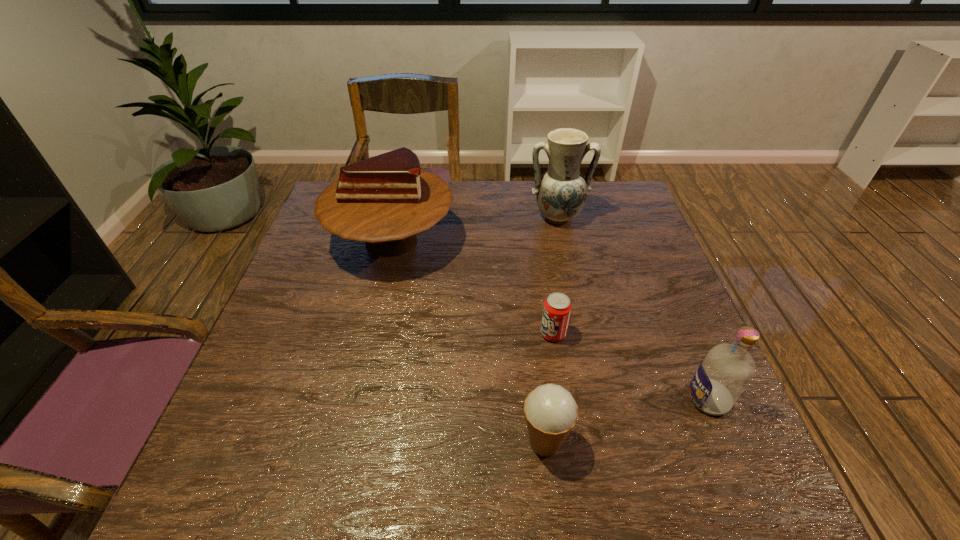
At what (x,y) coordinates should I click in order to perform the action: click on object situated at the left edge. Please return your answer as a coordinate pair (x, y). Image resolution: width=960 pixels, height=540 pixels. Looking at the image, I should click on (386, 200).

Where is `object situated at the right edge`? This screenshot has width=960, height=540. object situated at the right edge is located at coordinates (727, 369).

At what (x,y) coordinates should I click in order to perform the action: click on object at the far left corner. Please return your answer as a coordinate pair (x, y). Looking at the image, I should click on (386, 200).

In the image, there is a desktop. What are the coordinates of `vacant space at the far edge` in the screenshot? It's located at (452, 185).

Locate an element on the screen. This screenshot has width=960, height=540. vacant space at the near edge of the desktop is located at coordinates (658, 494).

The width and height of the screenshot is (960, 540). What are the coordinates of `free location at the left edge of the desktop` in the screenshot? It's located at (340, 273).

You are a GUI agent. You are given a task and a screenshot of the screen. Output one action in this format:
    pyautogui.click(x=<x>, y=<y>)
    Task: Click on the vacant space at the right edge of the desktop
    
    Given the screenshot: What is the action you would take?
    pyautogui.click(x=664, y=271)

In the image, there is a desktop. What are the coordinates of `free space at the far right corner` in the screenshot? It's located at (612, 221).

Find the location of a particular element. free spot between the soda can and the fourth farthest object is located at coordinates 631,367.

This screenshot has width=960, height=540. I want to click on unoccupied area between the leftmost object and the pottery, so click(x=474, y=229).